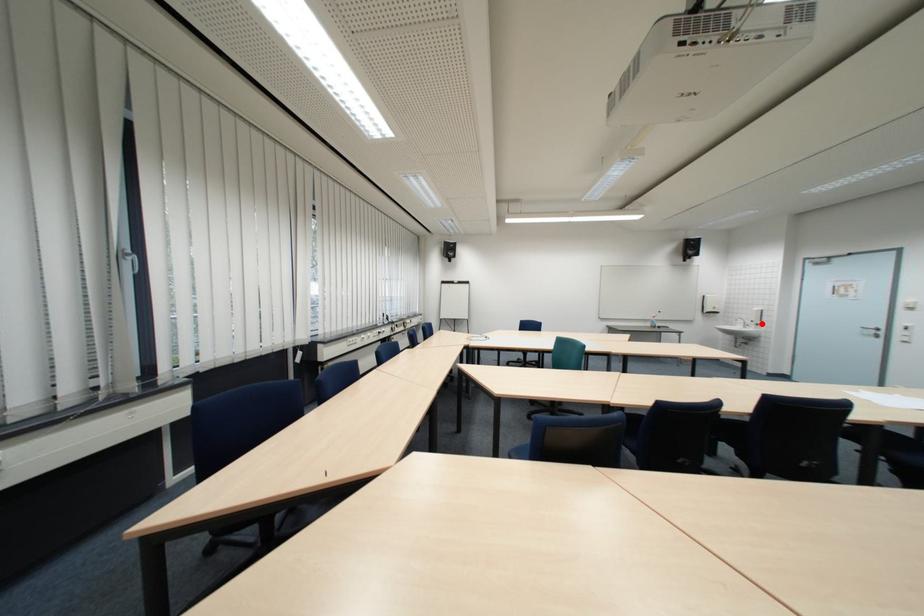
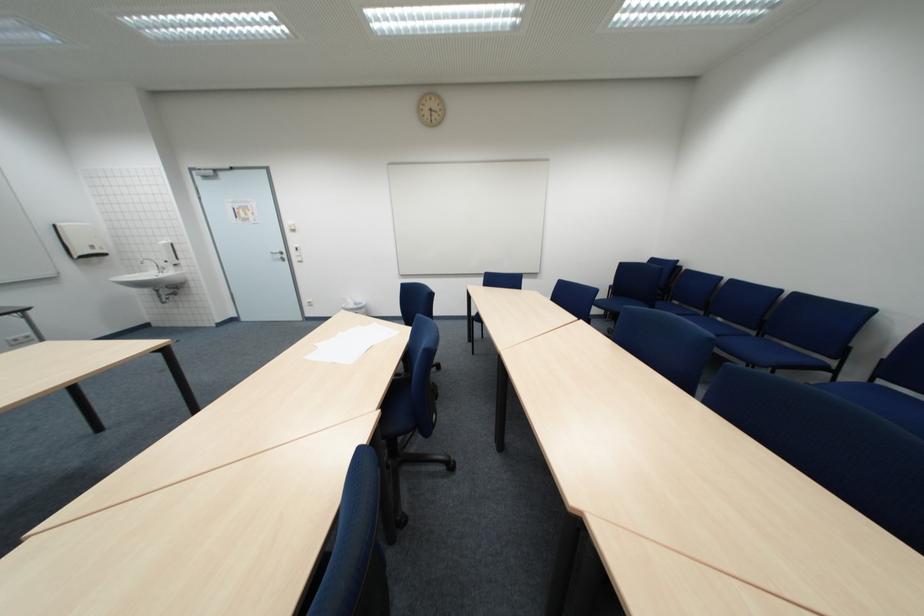
In the second image, find the point that corresponds to the highlighted location in the first image.

(176, 265)